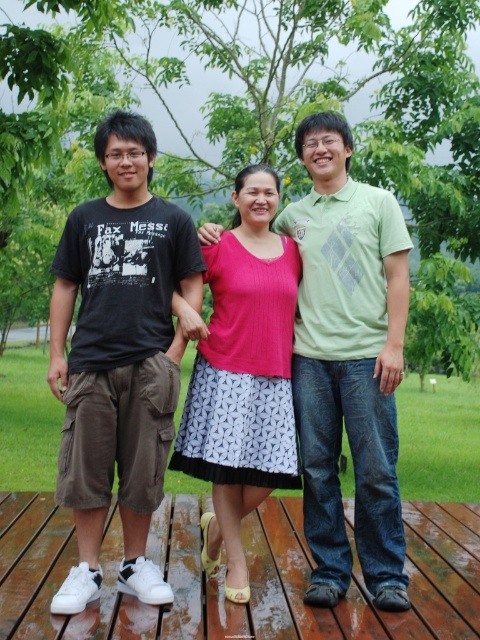
Does matte black t-shirt at left appear on the left side of wooden at center?

Correct, you'll find matte black t-shirt at left to the left of wooden at center.

Is matte black t-shirt at left taller than wooden at center?

Yes.

Is point (149, 220) farther from camera compared to point (248, 563)?

No, (149, 220) is closer to viewer.

I want to click on matte black t-shirt at left, so click(x=119, y=356).

Does wooden at center appear on the right side of green matte shirt at center?

Incorrect, wooden at center is not on the right side of green matte shirt at center.

Is point (436, 577) less distant than point (387, 216)?

No, (436, 577) is behind (387, 216).

This screenshot has width=480, height=640. I want to click on wooden at center, so tap(223, 577).

Between green leafy tree at upper center and green matte shirt at center, which one has less height?

green matte shirt at center

Is green leafy tree at upper center further to the viewer compared to green matte shirt at center?

Yes, green leafy tree at upper center is behind green matte shirt at center.

This screenshot has width=480, height=640. I want to click on green leafy tree at upper center, so click(250, 124).

Identify the location of green leafy tree at upper center. (250, 124).